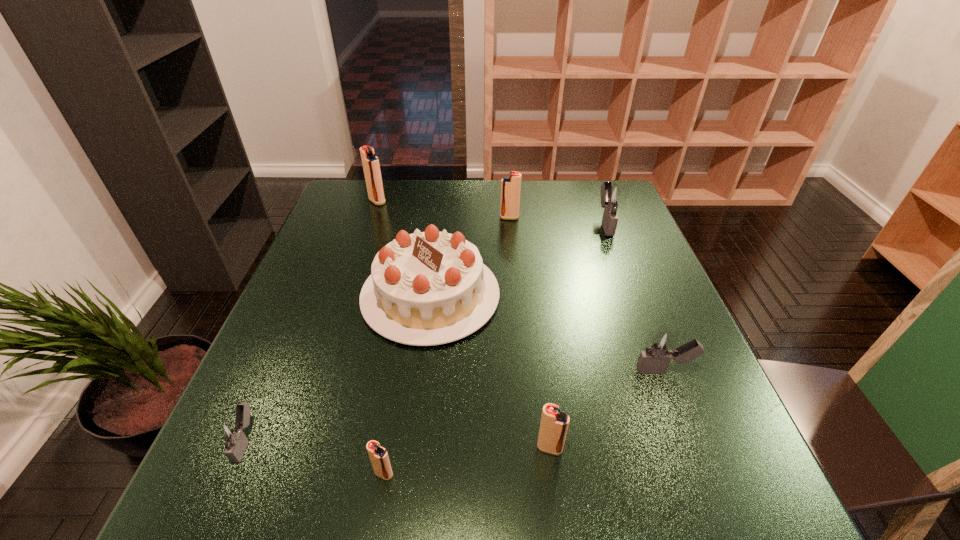
The width and height of the screenshot is (960, 540). What are the coordinates of `the sixth closest object to the nearest red igniter` in the screenshot? It's located at (x=613, y=196).

Locate which igniter is the closest to the farthest gray igniter. Please provide its 2D coordinates. Your answer should be formatted as a tuple, i.e. [(x, y)], where the tuple contains the x and y coordinates of a point satisfying the conditions above.

[(510, 185)]

Locate an element on the screen. This screenshot has height=540, width=960. the fifth closest igniter to the second smallest red igniter is located at coordinates (510, 185).

Find the location of `the second closest red igniter to the leftmost gray igniter`. the second closest red igniter to the leftmost gray igniter is located at coordinates (554, 424).

Point out which red igniter is positioned as the fourth nearest to the biggest gray igniter. Please provide its 2D coordinates. Your answer should be formatted as a tuple, i.e. [(x, y)], where the tuple contains the x and y coordinates of a point satisfying the conditions above.

[(378, 455)]

Choose which gray igniter is the second nearest neighbor to the second smallest red igniter. Please provide its 2D coordinates. Your answer should be formatted as a tuple, i.e. [(x, y)], where the tuple contains the x and y coordinates of a point satisfying the conditions above.

[(230, 435)]

Select which gray igniter appears as the closest to the biggest red igniter. Please provide its 2D coordinates. Your answer should be formatted as a tuple, i.e. [(x, y)], where the tuple contains the x and y coordinates of a point satisfying the conditions above.

[(613, 196)]

Find the location of a particular element. Image resolution: width=960 pixels, height=540 pixels. free space that satisfies the following two spatial constraints: 1. on the front side of the fifth nearest object; 2. on the right side of the second smallest gray igniter is located at coordinates (421, 371).

This screenshot has width=960, height=540. Identify the location of free space that satisfies the following two spatial constraints: 1. on the back side of the third nearest red igniter; 2. on the right side of the birthday cake. (440, 218).

Identify the location of vacant region that satisfies the following two spatial constraints: 1. on the front side of the birthday cake; 2. on the left side of the second smallest gray igniter. (421, 371).